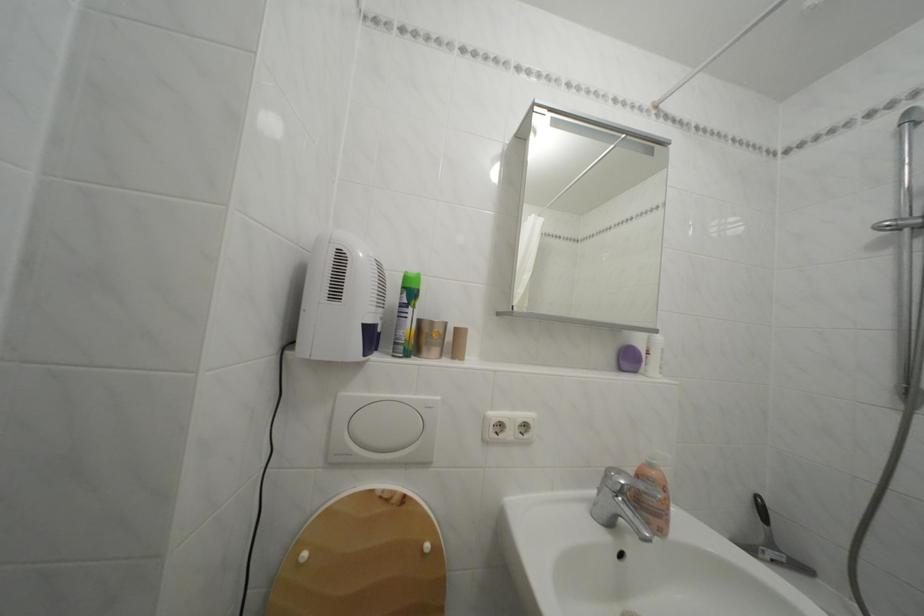
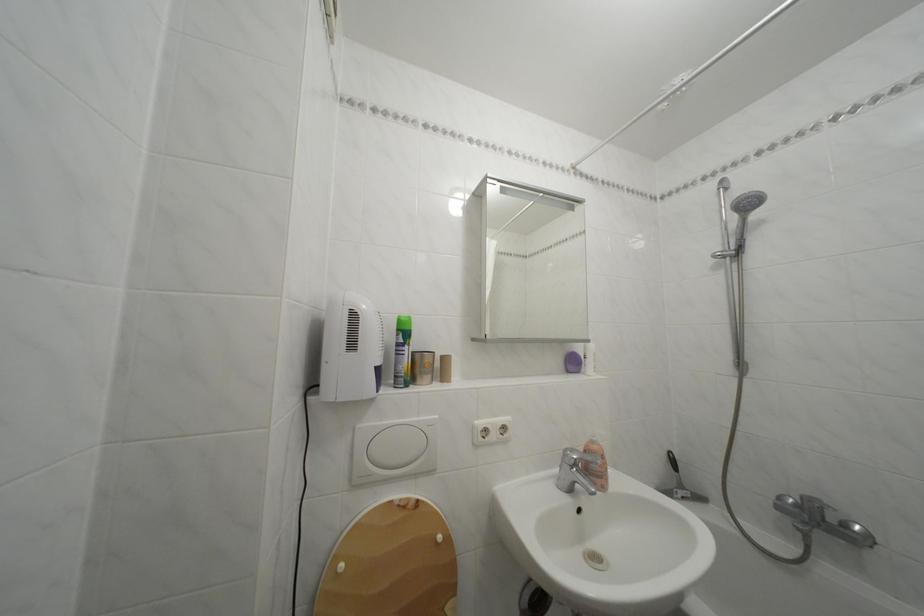
Find the pixel in the second image that matches the point at 772,517 in the first image.

(682, 468)